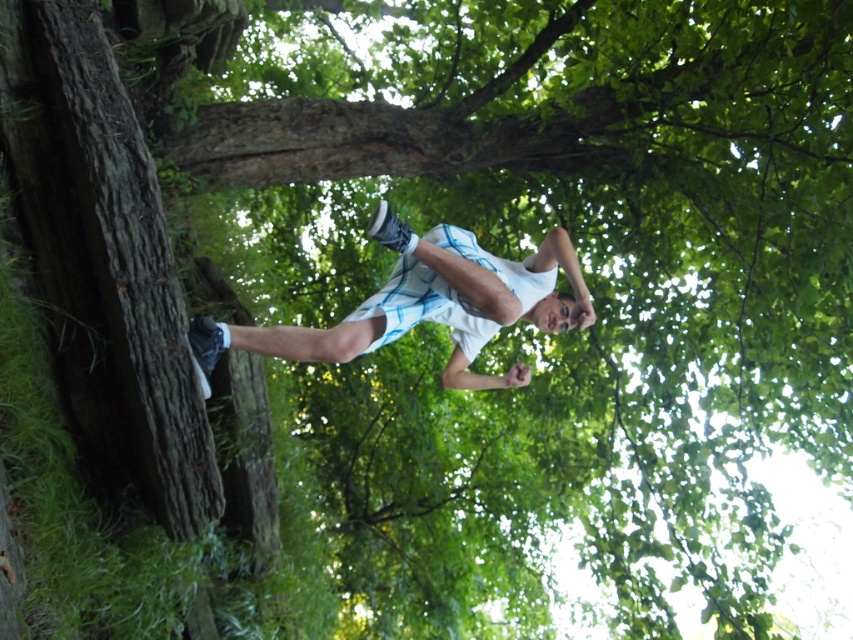
You are an observer looking at the scene. The rough bark tree trunk at left and the white matte shorts at center are both visible. Which object is positioned to the left of the other?

The rough bark tree trunk at left is positioned to the left of the white matte shorts at center.

You are a photographer trying to capture a photo of the white matte shorts at center and the rough bark tree trunk at left. If you want to ensure both are fully visible in the frame, which object should you focus on first to avoid cropping either?

You should focus on the rough bark tree trunk at left first because it is taller than the white matte shorts at center, so adjusting the frame to include its full height will automatically accommodate the shorter shorts.